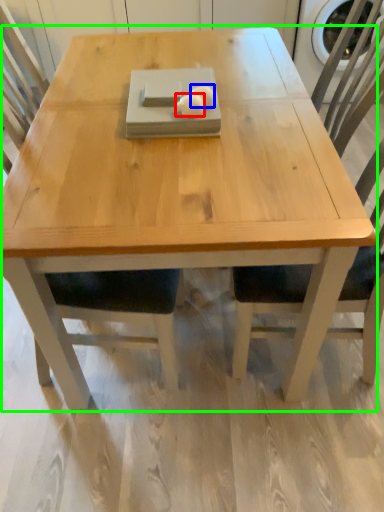
Question: Based on their relative distances, which object is nearer to food (highlighted by a red box)? Choose from food (highlighted by a blue box) and coffee table (highlighted by a green box).

Choices:
 (A) food
 (B) coffee table

Answer: (A)